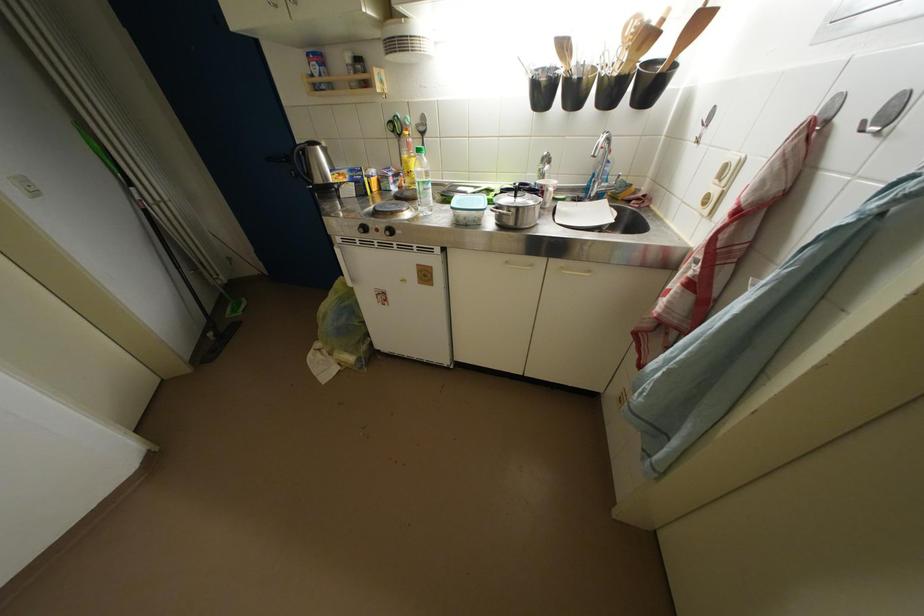
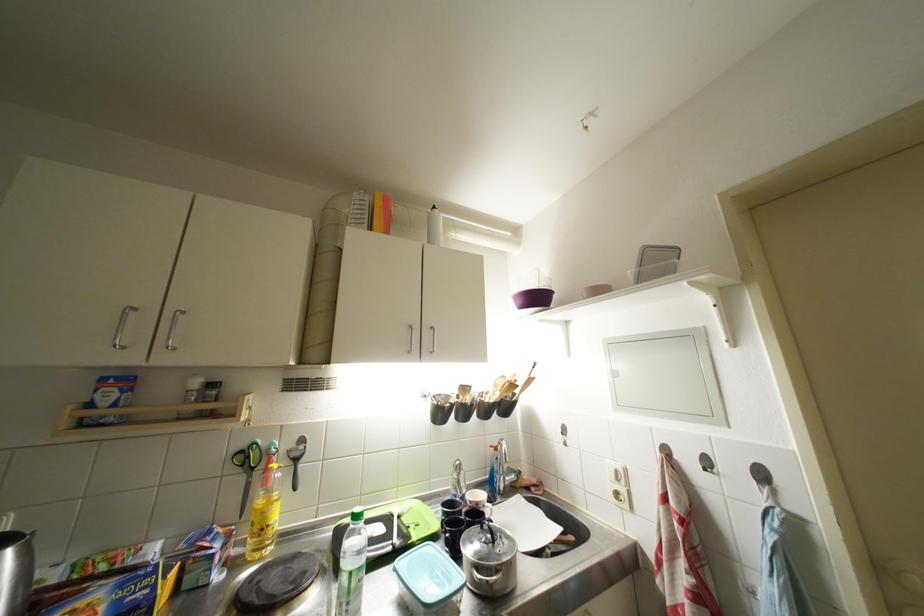
Find the pixel in the second image that matches [428,193] in the first image.

(359, 589)